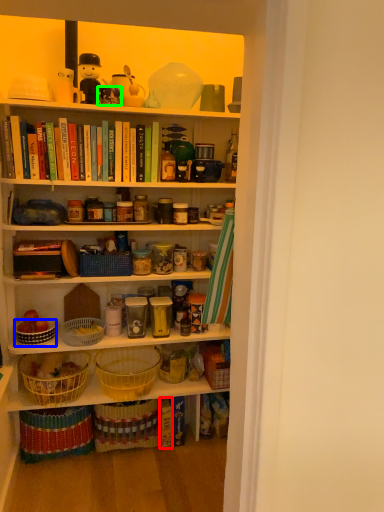
Question: Based on their relative distances, which object is nearer to book (highlighted by a red box)? Choose from bowl (highlighted by a blue box) and toy (highlighted by a green box).

Choices:
 (A) bowl
 (B) toy

Answer: (A)